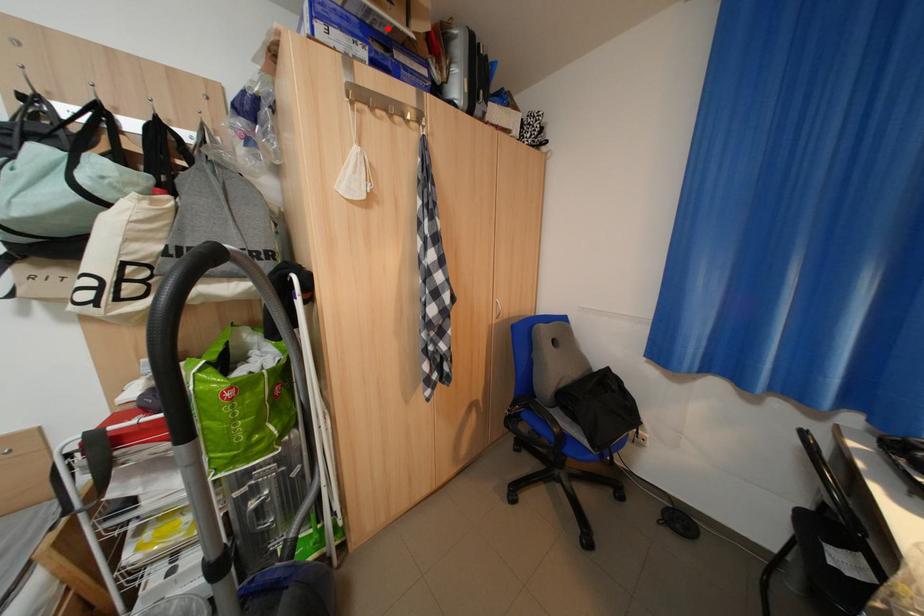
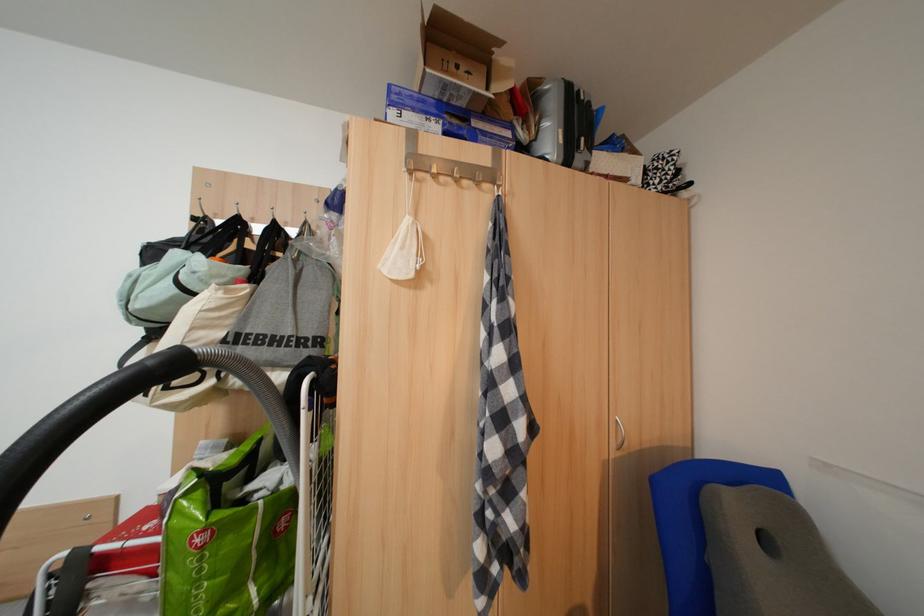
The point at the highlighted location is marked in the first image. Where is the corresponding point in the second image?

(466, 103)